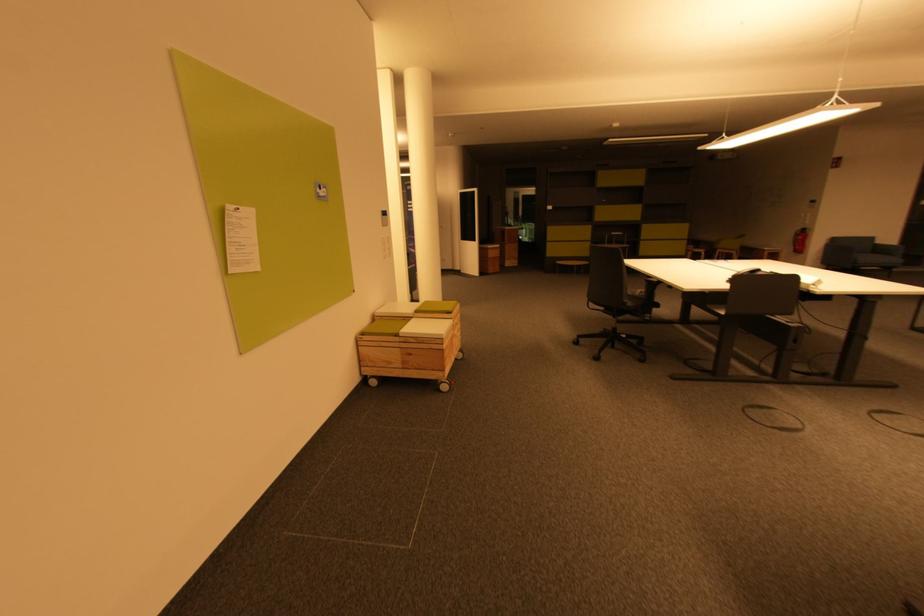
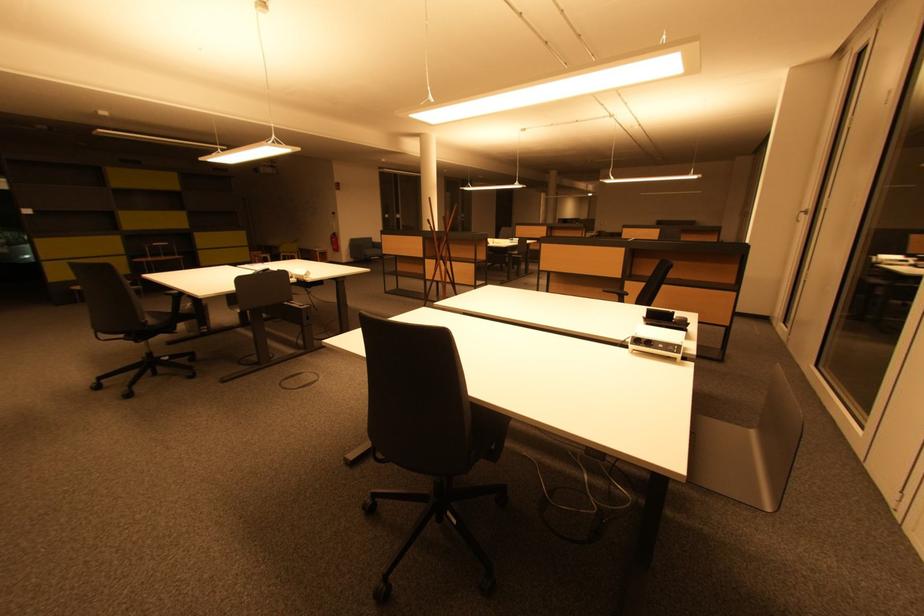
Question: The camera is either moving clockwise (left) or counter-clockwise (right) around the object. The first image is from the beginning of the video and the second image is from the end. Is the camera moving left or right when shooting the video?

Choices:
 (A) Left
 (B) Right

Answer: (A)